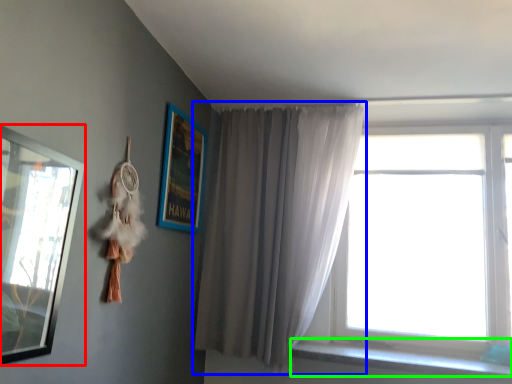
Question: Based on their relative distances, which object is nearer to picture frame (highlighted by a red box)? Choose from curtain (highlighted by a blue box) and window sill (highlighted by a green box).

Choices:
 (A) curtain
 (B) window sill

Answer: (A)